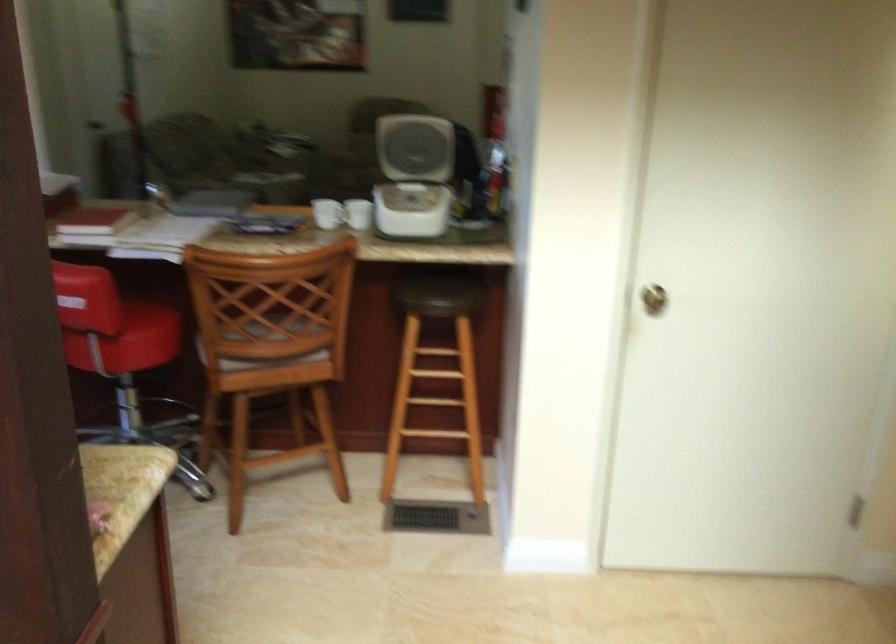
I want to click on red chair sitting surface, so click(x=141, y=319).